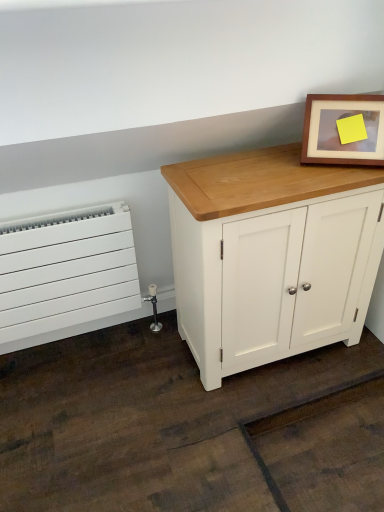
Question: Can you confirm if white matte radiator at left is thinner than wooden picture frame at upper right?

Choices:
 (A) yes
 (B) no

Answer: (A)

Question: Is white matte radiator at left closer to the viewer compared to wooden picture frame at upper right?

Choices:
 (A) no
 (B) yes

Answer: (A)

Question: From the image's perspective, is white matte radiator at left over wooden picture frame at upper right?

Choices:
 (A) yes
 (B) no

Answer: (B)

Question: Does white matte radiator at left have a greater width compared to wooden picture frame at upper right?

Choices:
 (A) no
 (B) yes

Answer: (A)

Question: Is white matte radiator at left further to the viewer compared to wooden picture frame at upper right?

Choices:
 (A) no
 (B) yes

Answer: (B)

Question: Is wooden picture frame at upper right taller or shorter than white painted wood cabinet at center?

Choices:
 (A) short
 (B) tall

Answer: (A)

Question: Looking at their shapes, would you say wooden picture frame at upper right is wider or thinner than white painted wood cabinet at center?

Choices:
 (A) wide
 (B) thin

Answer: (B)

Question: From the image's perspective, relative to white painted wood cabinet at center, is wooden picture frame at upper right above or below?

Choices:
 (A) above
 (B) below

Answer: (A)

Question: Is wooden picture frame at upper right inside the boundaries of white painted wood cabinet at center, or outside?

Choices:
 (A) inside
 (B) outside

Answer: (B)

Question: Looking at the image, does white matte radiator at left seem bigger or smaller compared to white painted wood cabinet at center?

Choices:
 (A) small
 (B) big

Answer: (A)

Question: Looking at their shapes, would you say white matte radiator at left is wider or thinner than white painted wood cabinet at center?

Choices:
 (A) thin
 (B) wide

Answer: (A)

Question: Choose the correct answer: Is white matte radiator at left inside white painted wood cabinet at center or outside it?

Choices:
 (A) inside
 (B) outside

Answer: (B)

Question: From the image's perspective, relative to white painted wood cabinet at center, is white matte radiator at left above or below?

Choices:
 (A) above
 (B) below

Answer: (B)

Question: Is wooden picture frame at upper right taller or shorter than white matte radiator at left?

Choices:
 (A) tall
 (B) short

Answer: (B)

Question: Is wooden picture frame at upper right inside or outside of white matte radiator at left?

Choices:
 (A) outside
 (B) inside

Answer: (A)